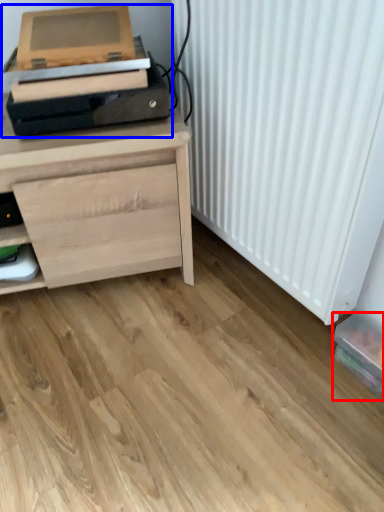
Question: Which point is closer to the camera, box (highlighted by a red box) or printer (highlighted by a blue box)?

Choices:
 (A) box
 (B) printer

Answer: (B)